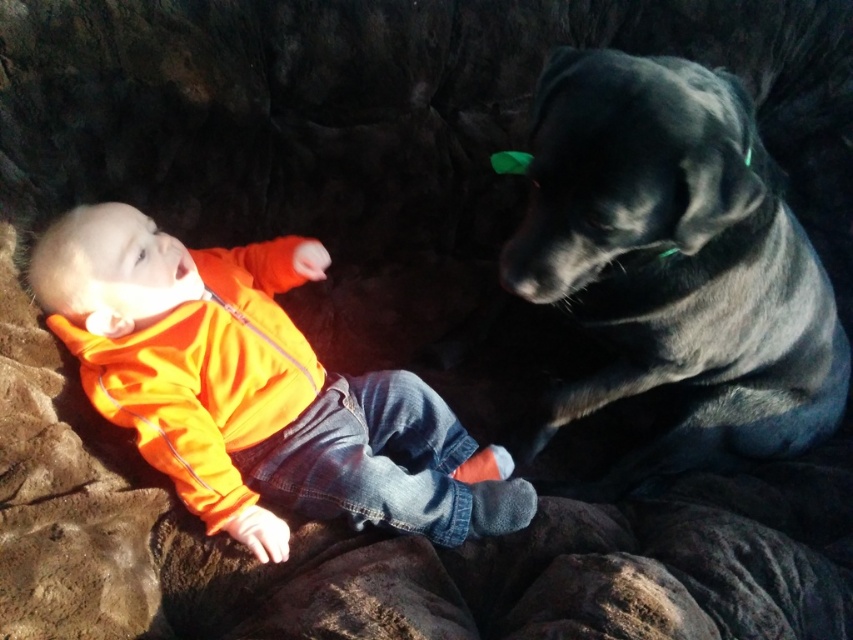
Locate an element on the screen. shiny black fur at upper right is located at coordinates (674, 262).